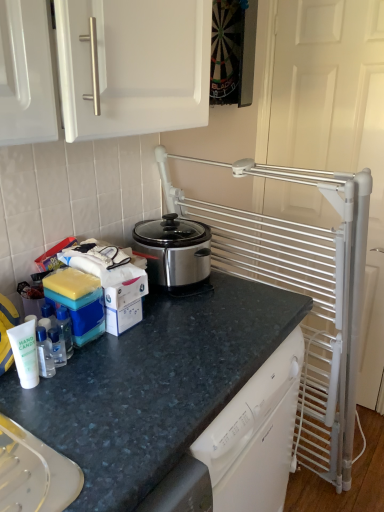
You are a GUI agent. You are given a task and a screenshot of the screen. Output one action in this format:
    pyautogui.click(x=<x>, y=<y>)
    Task: Click on the clear plastic bottle at left, arranged as the third bottle when viewed from the front
    
    Given the screenshot: What is the action you would take?
    pyautogui.click(x=57, y=347)

Describe the element at coordinates (44, 354) in the screenshot. Image resolution: width=384 pixels, height=512 pixels. I see `clear plastic bottle at lower left, which is the 3th bottle from back to front` at that location.

The width and height of the screenshot is (384, 512). Find the location of `white matte hand sanitizer at lower left, which is the fourth bottle from back to front`. white matte hand sanitizer at lower left, which is the fourth bottle from back to front is located at coordinates (25, 353).

Image resolution: width=384 pixels, height=512 pixels. Describe the element at coordinates (65, 329) in the screenshot. I see `clear plastic bottle at left, the first bottle viewed from the back` at that location.

Find the location of `clear plastic bottle at left, arranged as the third bottle when viewed from the front`. clear plastic bottle at left, arranged as the third bottle when viewed from the front is located at coordinates (57, 347).

Is clear plastic bottle at left, arranged as the third bottle when viewed from the front, located within clear plastic bottle at lower left, marked as the second bottle in a front-to-back arrangement?

No.

Is clear plastic bottle at lower left, which is the 3th bottle from back to front, oriented away from clear plastic bottle at left, which is counted as the second bottle, starting from the back?

No, clear plastic bottle at lower left, which is the 3th bottle from back to front, is not facing away from clear plastic bottle at left, which is counted as the second bottle, starting from the back.

Can you tell me how much clear plastic bottle at lower left, marked as the second bottle in a front-to-back arrangement, and clear plastic bottle at left, which is counted as the second bottle, starting from the back, differ in facing direction?

The facing directions of clear plastic bottle at lower left, marked as the second bottle in a front-to-back arrangement, and clear plastic bottle at left, which is counted as the second bottle, starting from the back, are 0.00321 degrees apart.

From a real-world perspective, is clear plastic bottle at lower left, which is the 3th bottle from back to front, physically above clear plastic bottle at left, which is counted as the second bottle, starting from the back?

Correct, in the physical world, clear plastic bottle at lower left, which is the 3th bottle from back to front, is higher than clear plastic bottle at left, which is counted as the second bottle, starting from the back.

Which object is closer to the camera taking this photo, granite dark blue countertop at center or clear plastic bottle at lower left, marked as the second bottle in a front-to-back arrangement?

Positioned in front is granite dark blue countertop at center.

Looking at this image, from the image's perspective, is granite dark blue countertop at center positioned above or below clear plastic bottle at lower left, marked as the second bottle in a front-to-back arrangement?

granite dark blue countertop at center is below clear plastic bottle at lower left, marked as the second bottle in a front-to-back arrangement.

Is granite dark blue countertop at center facing towards clear plastic bottle at lower left, which is the 3th bottle from back to front?

No.

Can you confirm if granite dark blue countertop at center is thinner than clear plastic bottle at lower left, which is the 3th bottle from back to front?

No, granite dark blue countertop at center is not thinner than clear plastic bottle at lower left, which is the 3th bottle from back to front.

Is white metal screen door at right facing away from clear plastic bottle at lower left, which is the 3th bottle from back to front?

No, white metal screen door at right is not facing away from clear plastic bottle at lower left, which is the 3th bottle from back to front.

Are white metal screen door at right and clear plastic bottle at lower left, marked as the second bottle in a front-to-back arrangement, far apart?

Indeed, white metal screen door at right is not near clear plastic bottle at lower left, marked as the second bottle in a front-to-back arrangement.

Which of these two, white metal screen door at right or clear plastic bottle at lower left, which is the 3th bottle from back to front, stands taller?

Standing taller between the two is white metal screen door at right.

Looking at this image, considering the relative sizes of white metal screen door at right and clear plastic bottle at lower left, marked as the second bottle in a front-to-back arrangement, in the image provided, is white metal screen door at right thinner than clear plastic bottle at lower left, marked as the second bottle in a front-to-back arrangement,?

In fact, white metal screen door at right might be wider than clear plastic bottle at lower left, marked as the second bottle in a front-to-back arrangement.

From the picture: In terms of size, does granite dark blue countertop at center appear bigger or smaller than white metal screen door at right?

granite dark blue countertop at center is bigger than white metal screen door at right.

Would you say granite dark blue countertop at center is a long distance from white metal screen door at right?

granite dark blue countertop at center is far away from white metal screen door at right.

Is point (70, 428) behind point (370, 277)?

No, (70, 428) is closer to viewer.

Is granite dark blue countertop at center turned away from clear plastic bottle at left, arranged as the third bottle when viewed from the front?

No, granite dark blue countertop at center is not facing the opposite direction of clear plastic bottle at left, arranged as the third bottle when viewed from the front.

From the image's perspective, which is above, granite dark blue countertop at center or clear plastic bottle at left, arranged as the third bottle when viewed from the front?

clear plastic bottle at left, arranged as the third bottle when viewed from the front.

Based on their sizes in the image, would you say granite dark blue countertop at center is bigger or smaller than clear plastic bottle at left, which is counted as the second bottle, starting from the back?

granite dark blue countertop at center is bigger than clear plastic bottle at left, which is counted as the second bottle, starting from the back.

Is granite dark blue countertop at center positioned far away from clear plastic bottle at left, which is counted as the second bottle, starting from the back?

granite dark blue countertop at center is actually quite close to clear plastic bottle at left, which is counted as the second bottle, starting from the back.

From a real-world perspective, does clear plastic bottle at left, which is counted as the second bottle, starting from the back, sit lower than white matte hand sanitizer at lower left, which is the fourth bottle from back to front?

Yes, from a real-world perspective, clear plastic bottle at left, which is counted as the second bottle, starting from the back, is beneath white matte hand sanitizer at lower left, which is the fourth bottle from back to front.

Considering the relative sizes of clear plastic bottle at left, arranged as the third bottle when viewed from the front, and white matte hand sanitizer at lower left, the 1th bottle viewed from the front, in the image provided, is clear plastic bottle at left, arranged as the third bottle when viewed from the front, thinner than white matte hand sanitizer at lower left, the 1th bottle viewed from the front,?

No.

Choose the correct answer: Is clear plastic bottle at left, which is counted as the second bottle, starting from the back, inside white matte hand sanitizer at lower left, the 1th bottle viewed from the front, or outside it?

clear plastic bottle at left, which is counted as the second bottle, starting from the back, is not inside white matte hand sanitizer at lower left, the 1th bottle viewed from the front, it's outside.

Is clear plastic bottle at left, arranged as the third bottle when viewed from the front, directly adjacent to white matte hand sanitizer at lower left, the 1th bottle viewed from the front?

Absolutely, clear plastic bottle at left, arranged as the third bottle when viewed from the front, is next to and touching white matte hand sanitizer at lower left, the 1th bottle viewed from the front.

How different are the orientations of clear plastic bottle at left, positioned as the fourth bottle in front-to-back order, and stainless steel slow cooker at center in degrees?

There is a 12.7-degree angle between the facing directions of clear plastic bottle at left, positioned as the fourth bottle in front-to-back order, and stainless steel slow cooker at center.

Who is more distant, clear plastic bottle at left, positioned as the fourth bottle in front-to-back order, or stainless steel slow cooker at center?

stainless steel slow cooker at center is further away from the camera.

Could you measure the distance between clear plastic bottle at left, positioned as the fourth bottle in front-to-back order, and stainless steel slow cooker at center?

clear plastic bottle at left, positioned as the fourth bottle in front-to-back order, is 17.36 inches from stainless steel slow cooker at center.

From a real-world perspective, is clear plastic bottle at left, positioned as the fourth bottle in front-to-back order, physically located above or below stainless steel slow cooker at center?

clear plastic bottle at left, positioned as the fourth bottle in front-to-back order, is situated lower than stainless steel slow cooker at center in the real world.

The image size is (384, 512). Identify the location of the 2nd bottle located above the clear plastic bottle at left, which is counted as the second bottle, starting from the back (from a real-world perspective). (44, 354).

This screenshot has height=512, width=384. I want to click on bottle that is the 2nd object located above the granite dark blue countertop at center (from the image's perspective), so click(44, 354).

Estimate the real-world distances between objects in this image. Which object is further from white matte hand sanitizer at lower left, the 1th bottle viewed from the front, white metal screen door at right or granite dark blue countertop at center?

white metal screen door at right lies further to white matte hand sanitizer at lower left, the 1th bottle viewed from the front, than the other object.

When comparing their distances from white matte hand sanitizer at lower left, the 1th bottle viewed from the front, does granite dark blue countertop at center or stainless steel slow cooker at center seem further?

stainless steel slow cooker at center is positioned further to the anchor white matte hand sanitizer at lower left, the 1th bottle viewed from the front.

Estimate the real-world distances between objects in this image. Which object is further from clear plastic bottle at left, the first bottle viewed from the back, clear plastic bottle at left, which is counted as the second bottle, starting from the back, or white matte hand sanitizer at lower left, which is the fourth bottle from back to front?

The object further to clear plastic bottle at left, the first bottle viewed from the back, is white matte hand sanitizer at lower left, which is the fourth bottle from back to front.

Which object lies further to the anchor point clear plastic bottle at left, the first bottle viewed from the back, clear plastic bottle at lower left, which is the 3th bottle from back to front, or white metal screen door at right?

The object further to clear plastic bottle at left, the first bottle viewed from the back, is white metal screen door at right.

Looking at the image, which one is located closer to clear plastic bottle at lower left, which is the 3th bottle from back to front, clear plastic bottle at left, arranged as the third bottle when viewed from the front, or white matte hand sanitizer at lower left, which is the fourth bottle from back to front?

Based on the image, clear plastic bottle at left, arranged as the third bottle when viewed from the front, appears to be nearer to clear plastic bottle at lower left, which is the 3th bottle from back to front.

Based on their spatial positions, is stainless steel slow cooker at center or white matte hand sanitizer at lower left, which is the fourth bottle from back to front, closer to clear plastic bottle at lower left, marked as the second bottle in a front-to-back arrangement?

Based on the image, white matte hand sanitizer at lower left, which is the fourth bottle from back to front, appears to be nearer to clear plastic bottle at lower left, marked as the second bottle in a front-to-back arrangement.

Based on their spatial positions, is stainless steel slow cooker at center or clear plastic bottle at left, which is counted as the second bottle, starting from the back, closer to clear plastic bottle at left, the first bottle viewed from the back?

clear plastic bottle at left, which is counted as the second bottle, starting from the back.

Which object lies nearer to the anchor point clear plastic bottle at left, the first bottle viewed from the back, white metal screen door at right or granite dark blue countertop at center?

The object closer to clear plastic bottle at left, the first bottle viewed from the back, is granite dark blue countertop at center.

The image size is (384, 512). Identify the location of bottle between clear plastic bottle at left, arranged as the third bottle when viewed from the front, and white metal screen door at right, in the horizontal direction. [65, 329].

Find the location of a particular element. This screenshot has width=384, height=512. countertop between clear plastic bottle at lower left, which is the 3th bottle from back to front, and white metal screen door at right is located at coordinates (162, 379).

You are a GUI agent. You are given a task and a screenshot of the screen. Output one action in this format:
    pyautogui.click(x=<x>, y=<y>)
    Task: Click on the bottle between clear plastic bottle at lower left, marked as the second bottle in a front-to-back arrangement, and granite dark blue countertop at center from top to bottom
    
    Given the screenshot: What is the action you would take?
    pyautogui.click(x=25, y=353)

This screenshot has height=512, width=384. Find the location of `countertop located between stainless steel slow cooker at center and white metal screen door at right in the left-right direction`. countertop located between stainless steel slow cooker at center and white metal screen door at right in the left-right direction is located at coordinates (162, 379).